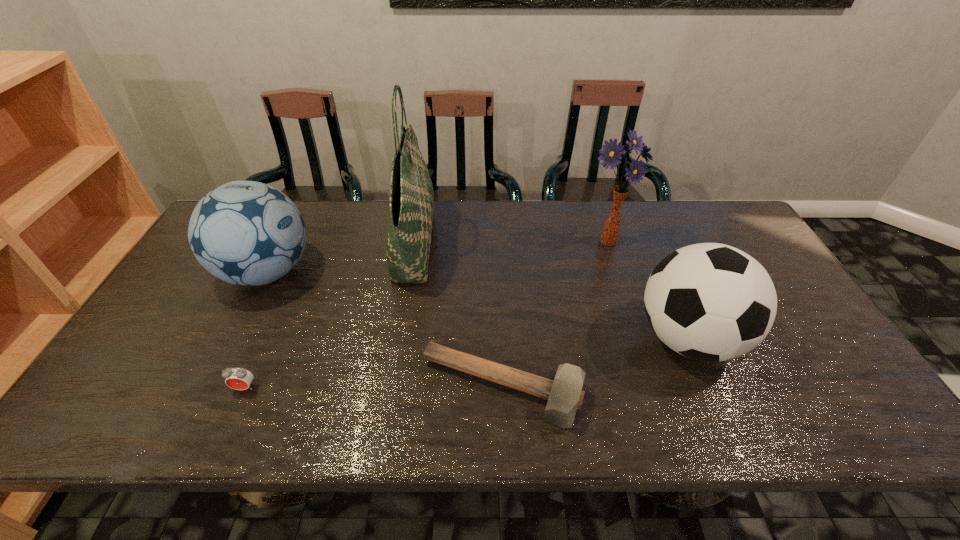
This screenshot has width=960, height=540. In order to click on the third object from left to right in this screenshot , I will do `click(411, 191)`.

Identify the location of the tallest object. click(x=411, y=191).

Locate an element on the screen. This screenshot has height=540, width=960. the second tallest object is located at coordinates (612, 153).

The height and width of the screenshot is (540, 960). In order to click on the left soccer ball in this screenshot , I will do `click(247, 233)`.

Image resolution: width=960 pixels, height=540 pixels. What are the coordinates of `the right soccer ball` in the screenshot? It's located at (712, 302).

I want to click on alarm clock, so click(237, 378).

Where is `the shortest object`? This screenshot has width=960, height=540. the shortest object is located at coordinates (565, 395).

This screenshot has height=540, width=960. In order to click on mallet in this screenshot , I will do `click(565, 395)`.

Identify the location of vacant space situated 0.200m on the right of the tote bag. (498, 243).

In order to click on free space located on the back of the fifth shortest object in this screenshot , I will do `click(596, 201)`.